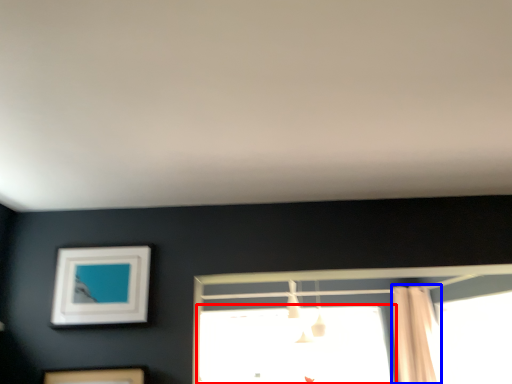
Question: Which point is further to the camera, window (highlighted by a red box) or shower curtain (highlighted by a blue box)?

Choices:
 (A) window
 (B) shower curtain

Answer: (A)